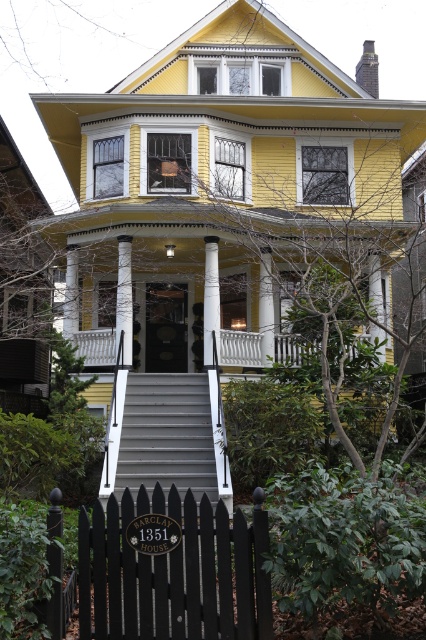
Question: Which of the following is the closest to the observer?

Choices:
 (A) (109, 476)
 (B) (112, 342)
 (C) (207, 330)

Answer: (A)

Question: Can you confirm if white painted wood balustrade at center is positioned to the right of white glossy pillar at center?

Choices:
 (A) yes
 (B) no

Answer: (A)

Question: Does smooth gray stairs at center have a larger size compared to white painted wood balustrade at center?

Choices:
 (A) no
 (B) yes

Answer: (B)

Question: Considering the real-world distances, which object is farthest from the smooth gray stairs at center?

Choices:
 (A) white painted wood porch at center
 (B) black wood picket fence at lower left
 (C) white glossy pillar at center

Answer: (B)

Question: Is smooth gray stairs at center closer to camera compared to white painted wood balustrade at center?

Choices:
 (A) yes
 (B) no

Answer: (A)

Question: Which object appears closest to the camera in this image?

Choices:
 (A) black wood picket fence at lower left
 (B) white glossy pillar at center

Answer: (A)